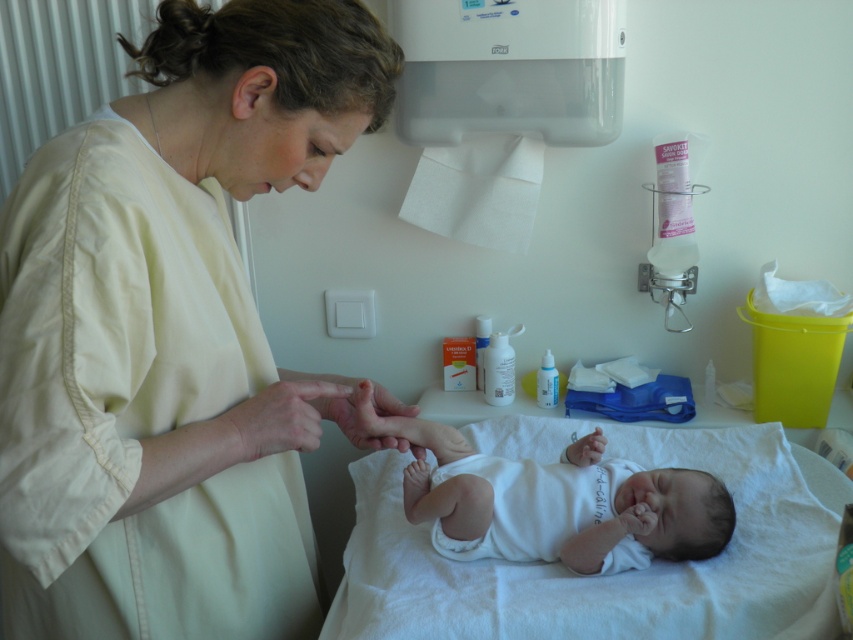
You are a nurse who needs to place a medical kit on the table between the white soft hospital bed at center and the smooth skin hand at center. Which side should you place it on?

The white soft hospital bed at center is positioned on the right side of smooth skin hand at center, so you should place the medical kit on the left side of the smooth skin hand at center to keep it between them.

You are a nurse who needs to place a small medical kit on the changing table. The medical kit is 15 cm wide. Considering the white soft hospital bed at center and the smooth skin hand at center, which object can the medical kit fit next to without overlapping?

The medical kit can fit next to the white soft hospital bed at center because its width is larger than the smooth skin hand at center, providing enough space.

You are a healthcare professional standing at the edge of the changing table. You need to reach the point marked at coordinates [659,444] to administer a vitamin D drop. Considering your arm length is 2.5 feet, can you comfortably reach that point without moving your position?

The point at coordinates [659,444] is 5.19 feet away from the camera. Since your arm length is only 2.5 feet, you cannot comfortably reach that point without moving your position.